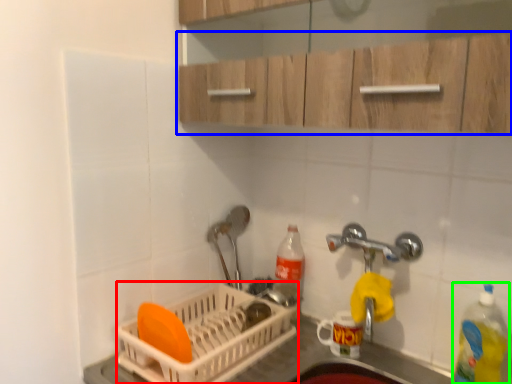
Question: Which is nearer to the basket (highlighted by a red box)? cabinetry (highlighted by a blue box) or bottle (highlighted by a green box).

Choices:
 (A) cabinetry
 (B) bottle

Answer: (B)